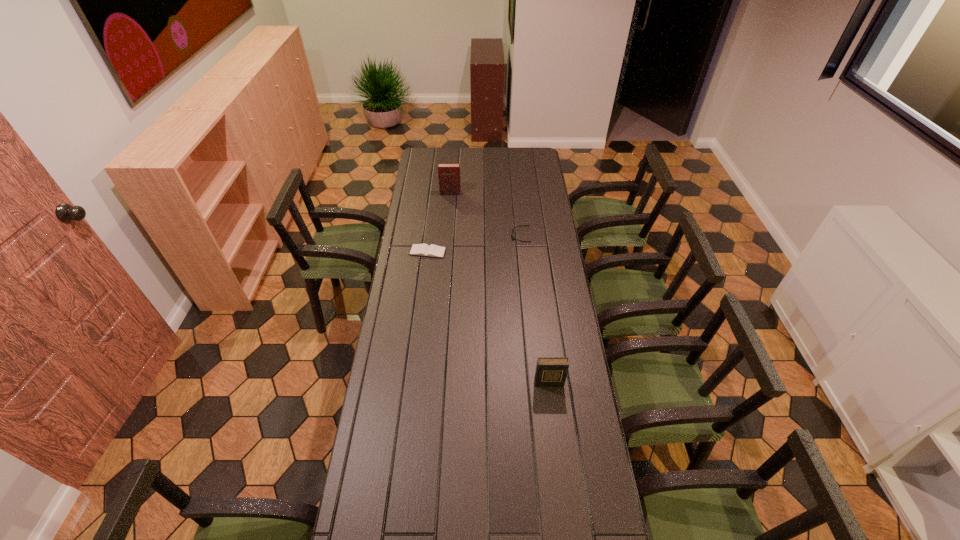
Where is `the farthest diary`? The width and height of the screenshot is (960, 540). the farthest diary is located at coordinates pos(448,173).

Image resolution: width=960 pixels, height=540 pixels. Find the location of `the tallest object`. the tallest object is located at coordinates (448, 173).

You are a GUI agent. You are given a task and a screenshot of the screen. Output one action in this format:
    pyautogui.click(x=<x>, y=<y>)
    Task: Click on the nearest diary
    The width and height of the screenshot is (960, 540).
    Given the screenshot: What is the action you would take?
    pyautogui.click(x=550, y=371)

Image resolution: width=960 pixels, height=540 pixels. Find the location of `the second tallest diary`. the second tallest diary is located at coordinates (550, 371).

This screenshot has height=540, width=960. Identify the location of sunglasses. (513, 238).

You are a GUI agent. You are given a task and a screenshot of the screen. Output one action in this format:
    pyautogui.click(x=<x>, y=<y>)
    Task: Click on the second farthest diary
    This screenshot has width=960, height=540.
    Given the screenshot: What is the action you would take?
    pyautogui.click(x=425, y=250)

The image size is (960, 540). Find the location of `the shortest diary`. the shortest diary is located at coordinates (425, 250).

Where is `blank area located on the front cover of the tallest object`? The height and width of the screenshot is (540, 960). blank area located on the front cover of the tallest object is located at coordinates (448, 211).

Identify the location of vacant space situated on the front cover of the nearest object. (555, 435).

Where is `vacant space situated on the front-facing side of the third nearest object`? The height and width of the screenshot is (540, 960). vacant space situated on the front-facing side of the third nearest object is located at coordinates (465, 236).